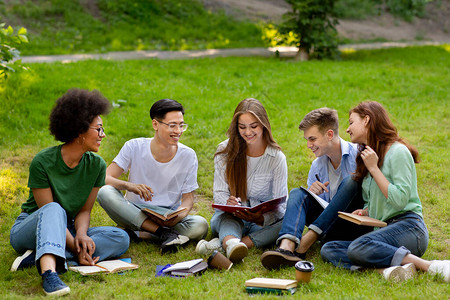
I want to click on closed notebook, so click(189, 266), click(197, 274), click(261, 288), click(268, 283), click(365, 220).